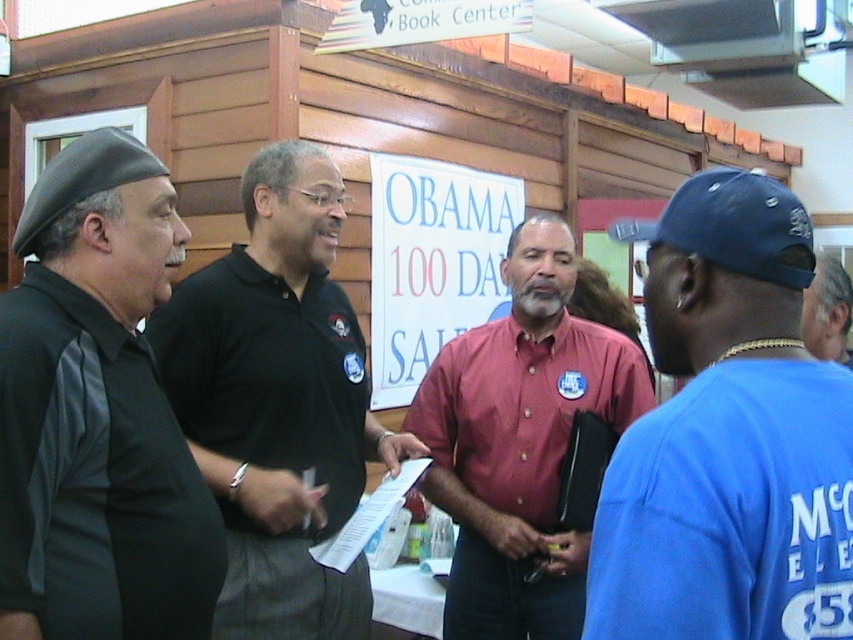
Question: Is black matte beret at left closer to the viewer compared to black polo shirt at center?

Choices:
 (A) no
 (B) yes

Answer: (B)

Question: Is black matte beret at left below blue cotton polo shirt at right?

Choices:
 (A) no
 (B) yes

Answer: (A)

Question: Can you confirm if black matte beret at left is positioned below blue cotton polo shirt at right?

Choices:
 (A) yes
 (B) no

Answer: (B)

Question: Which is farther from the blue fabric cap at upper right?

Choices:
 (A) red button-up shirt at center
 (B) blue fabric baseball cap at right
 (C) blue cotton polo shirt at right

Answer: (B)

Question: Which is farther from the black polo shirt at center?

Choices:
 (A) blue fabric baseball cap at right
 (B) blue cotton polo shirt at right
 (C) black matte beret at left
 (D) blue fabric cap at upper right

Answer: (A)

Question: Estimate the real-world distances between objects in this image. Which object is farther from the black matte beret at left?

Choices:
 (A) blue cotton polo shirt at right
 (B) blue fabric baseball cap at right
 (C) red button-up shirt at center

Answer: (B)